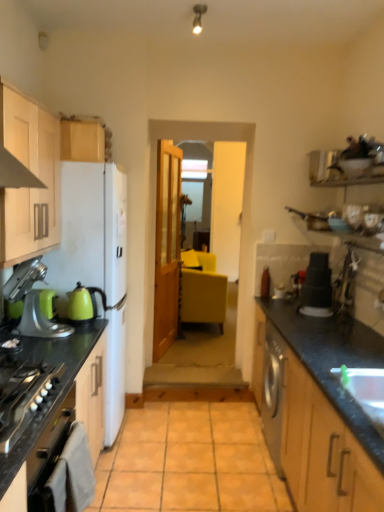
Locate an element on the screen. The height and width of the screenshot is (512, 384). free location in front of clear glass door at center is located at coordinates (191, 375).